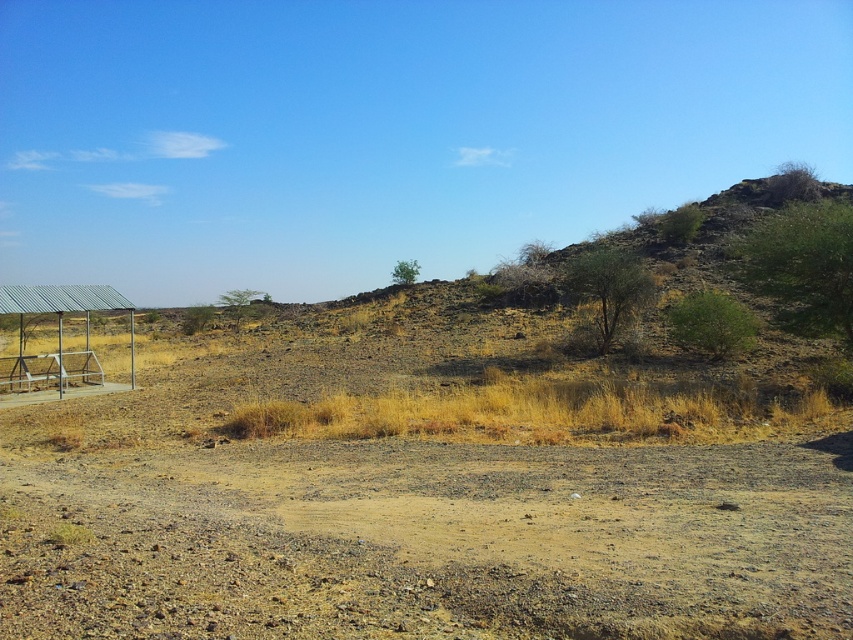
Question: Does brown gravel dirt track at center have a greater width compared to metallic roof at left?

Choices:
 (A) no
 (B) yes

Answer: (A)

Question: Among these objects, which one is nearest to the camera?

Choices:
 (A) brown gravel dirt track at center
 (B) metallic roof at left

Answer: (A)

Question: Does brown gravel dirt track at center lie behind metallic roof at left?

Choices:
 (A) yes
 (B) no

Answer: (B)

Question: Which of the following is the closest to the observer?

Choices:
 (A) (341, 496)
 (B) (6, 369)

Answer: (A)

Question: Which point is closer to the camera?

Choices:
 (A) metallic roof at left
 (B) brown gravel dirt track at center

Answer: (B)

Question: Does brown gravel dirt track at center appear over metallic roof at left?

Choices:
 (A) no
 (B) yes

Answer: (A)